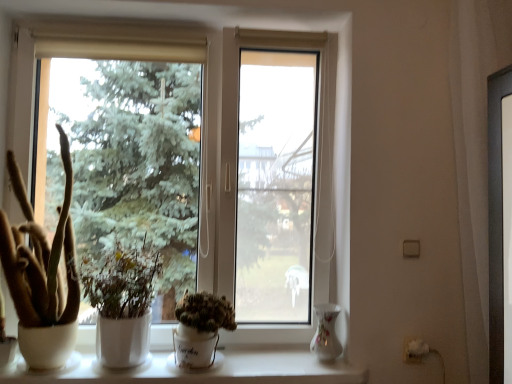
Question: Based on their sizes in the image, would you say white matte plant at center, which ranks as the 2th houseplant in right-to-left order, is bigger or smaller than porcelain floral vase at lower right?

Choices:
 (A) small
 (B) big

Answer: (B)

Question: Is white matte plant at center, which ranks as the 2th houseplant in right-to-left order, taller or shorter than porcelain floral vase at lower right?

Choices:
 (A) tall
 (B) short

Answer: (A)

Question: Considering the real-world distances, which object is closest to the white ceramic at lower center?

Choices:
 (A) brown fuzzy cactus at left, the 1th houseplant in the left-to-right sequence
 (B) white matte plant at center, the 2th houseplant positioned from the left
 (C) porcelain floral vase at lower right
 (D) transparent glass window at center
 (E) green matte cactus at center, which appears as the first houseplant when viewed from the right

Answer: (E)

Question: Estimate the real-world distances between objects in this image. Which object is farther from the green matte cactus at center, the 3th houseplant viewed from the left?

Choices:
 (A) porcelain floral vase at lower right
 (B) white ceramic at lower center
 (C) transparent glass window at center
 (D) brown fuzzy cactus at left, acting as the 3th houseplant starting from the right
 (E) white matte plant at center, which ranks as the 2th houseplant in right-to-left order

Answer: (D)